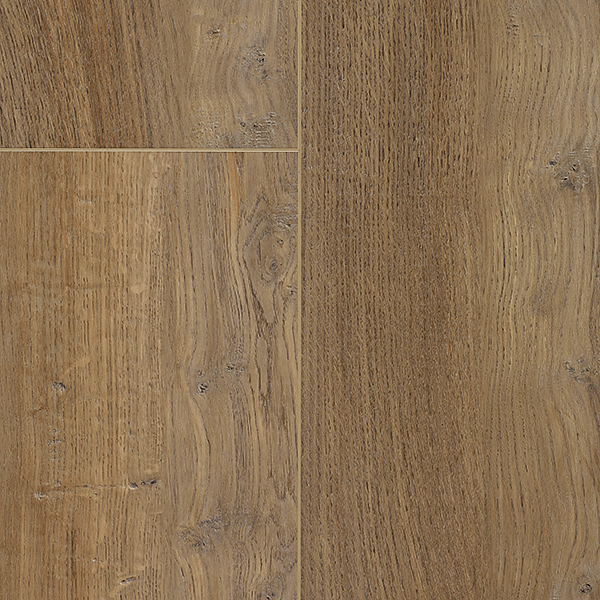
Find the location of a particular element. This screenshot has height=600, width=600. dark pine wood is located at coordinates (105, 345), (536, 416).